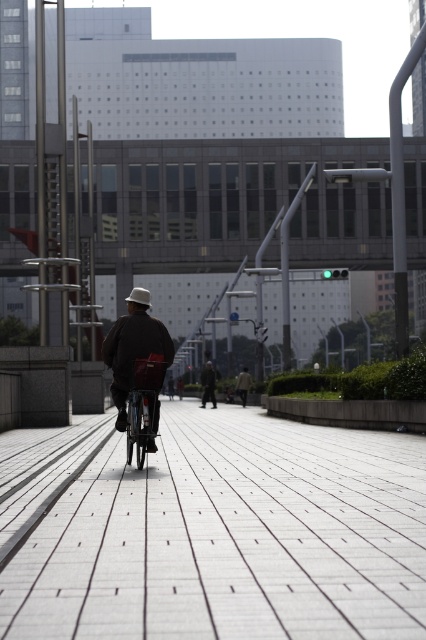
You are standing at the point marked by the coordinates point (230,538) in the image. Looking around, you see the gray concrete pavement at center. What is directly under your feet?

The point marked by the coordinates point (230,538) is directly on the gray concrete pavement at center.

You are a delivery robot positioned at the point with coordinates (230,538). Based on the scene description, what type of surface are you currently standing on?

The point at coordinates (230,538) corresponds to gray concrete pavement at center, so the delivery robot is standing on gray concrete pavement.

You are a delivery person who needs to know if your bicycle can fit through a narrow gap between two parked cars. You see the gray concrete pavement at center and the dark brown leather jacket at center in the image. Which object is wider, and does this suggest the gap is wide enough for your bicycle?

The gray concrete pavement at center is wider than the dark brown leather jacket at center. Since the pavement is wider, the gap between the parked cars might be wide enough for your bicycle, but you should still check the actual space before proceeding.